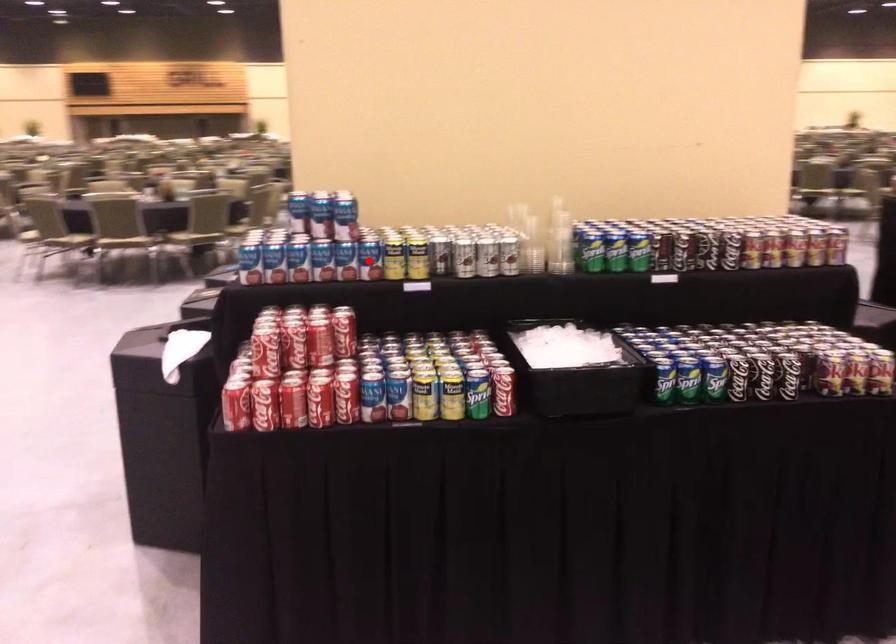
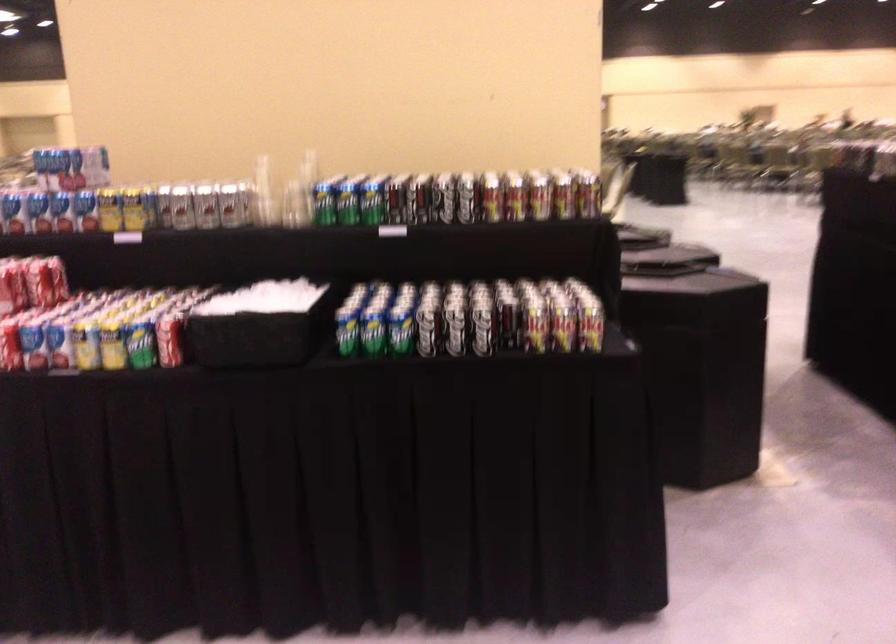
In the second image, find the point that corresponds to the highlighted location in the first image.

(85, 210)